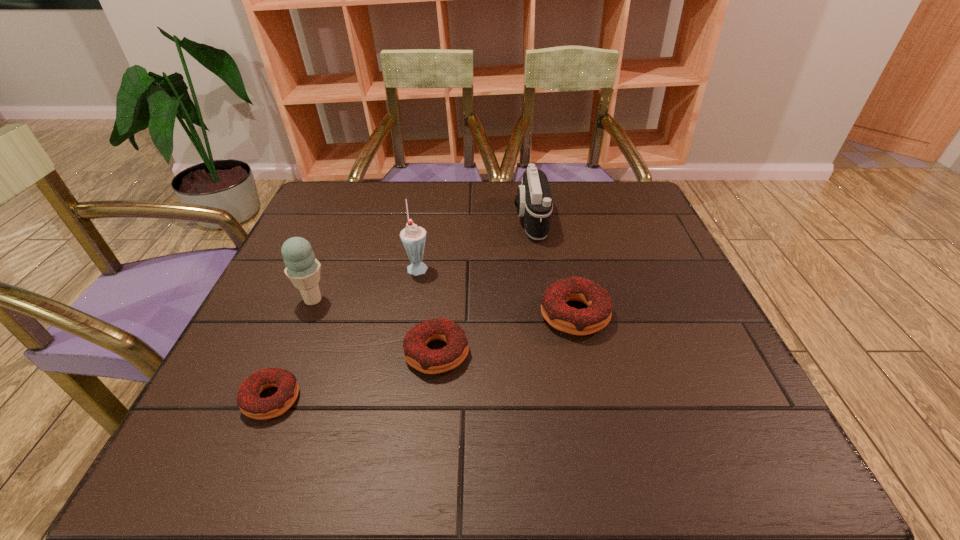
This screenshot has height=540, width=960. What are the coordinates of `vacant area situated on the back of the shortest object` in the screenshot? It's located at (295, 343).

This screenshot has width=960, height=540. Find the location of `blank space located 0.160m on the left of the second tallest doughnut`. blank space located 0.160m on the left of the second tallest doughnut is located at coordinates (323, 353).

Find the location of a particular element. This screenshot has height=540, width=960. blank space located on the back of the rightmost doughnut is located at coordinates (557, 236).

At what (x,y) coordinates should I click in order to perform the action: click on free location located 0.350m on the front lens of the fourth shortest object. Please return your answer as a coordinate pair (x, y). The image size is (960, 540). Looking at the image, I should click on (385, 220).

Where is `vacant area situated 0.160m on the front lens of the fourth shortest object`? This screenshot has width=960, height=540. vacant area situated 0.160m on the front lens of the fourth shortest object is located at coordinates (455, 220).

Where is `free space located 0.380m on the front lens of the fourth shortest object`? The width and height of the screenshot is (960, 540). free space located 0.380m on the front lens of the fourth shortest object is located at coordinates (374, 220).

In order to click on free space located 0.120m on the right of the ice cream in this screenshot , I will do `click(384, 300)`.

Find the location of a particular element. free space located 0.320m on the straw side of the second farthest object is located at coordinates (564, 266).

You are a GUI agent. You are given a task and a screenshot of the screen. Output one action in this format:
    pyautogui.click(x=<x>, y=<y>)
    Task: Click on the object that is at the far edge
    The height and width of the screenshot is (540, 960).
    Given the screenshot: What is the action you would take?
    pyautogui.click(x=534, y=203)

In order to click on doughnut that is at the left edge in this screenshot , I will do `click(248, 400)`.